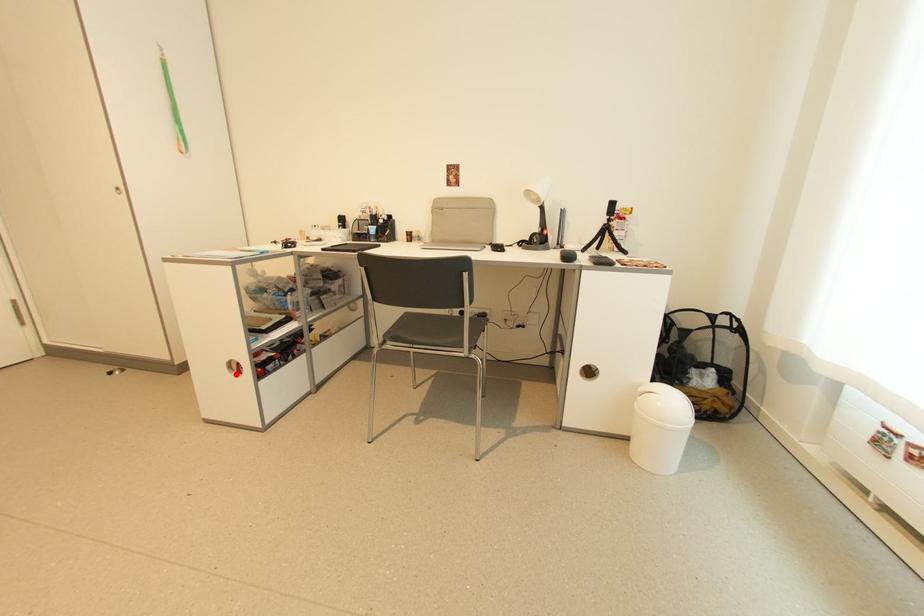
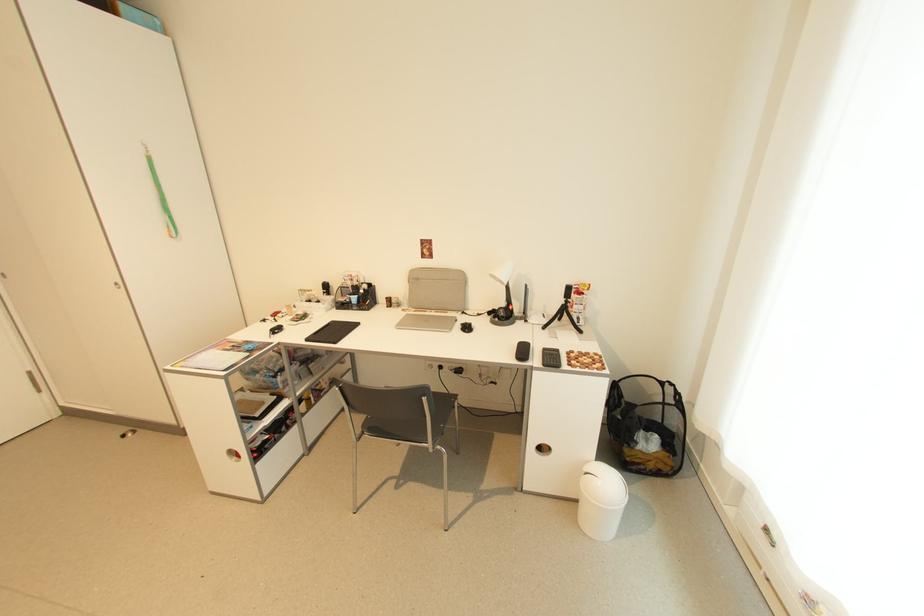
Find the pixel in the second image that matches the highlighted location in the first image.

(237, 460)